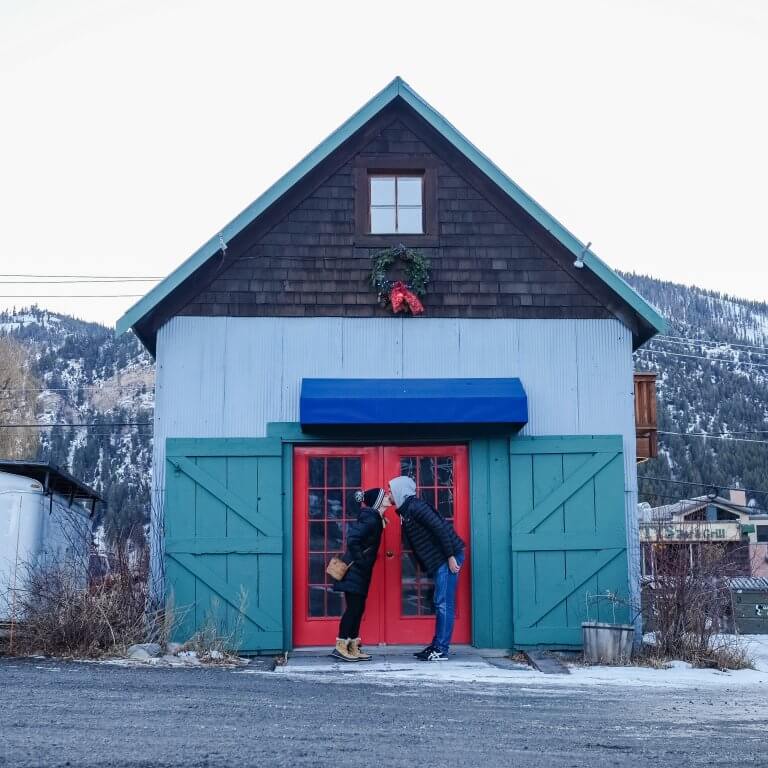
At what (x,y) coordinates should I click in order to perform the action: click on glass on door. Please return your answer as a coordinate pair (x, y). This screenshot has width=768, height=768. Looking at the image, I should click on (154, 120), (329, 498), (426, 472).